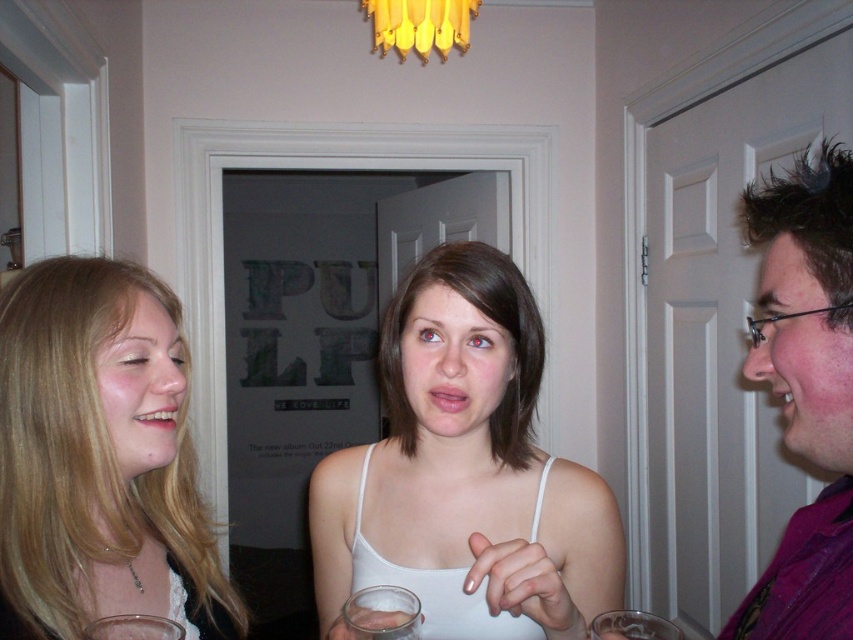
Does white fabric tank top at center have a lesser height compared to clear glass wine glass at lower left?

In fact, white fabric tank top at center may be taller than clear glass wine glass at lower left.

Which is behind, point (527, 477) or point (173, 636)?

The point (527, 477) is more distant.

Where is `white fabric tank top at center`? white fabric tank top at center is located at coordinates (465, 472).

Which of these two, purple fabric shirt at right or yellow glass chandelier at upper center, stands shorter?

yellow glass chandelier at upper center

The image size is (853, 640). What are the coordinates of `purple fabric shirt at right` in the screenshot? It's located at (805, 390).

Is point (13, 292) behind point (109, 620)?

That is True.

Is blonde hair at left to the left of clear glass wine glass at lower left from the viewer's perspective?

Yes, blonde hair at left is to the left of clear glass wine glass at lower left.

The image size is (853, 640). What do you see at coordinates (102, 456) in the screenshot?
I see `blonde hair at left` at bounding box center [102, 456].

I want to click on blonde hair at left, so click(x=102, y=456).